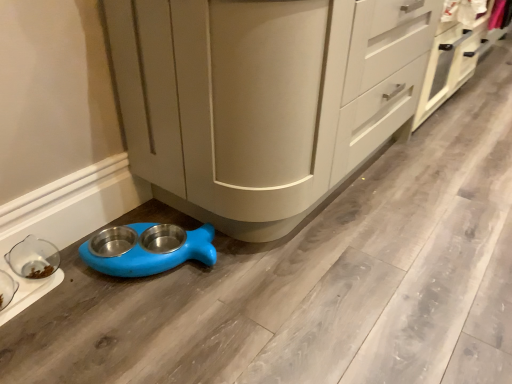
At what (x,y) coordinates should I click in order to perform the action: click on free spot behind blue plastic pet feeder at lower left, the 1th appliance positioned from the right. Please return your answer as a coordinate pair (x, y). The height and width of the screenshot is (384, 512). Looking at the image, I should click on (159, 212).